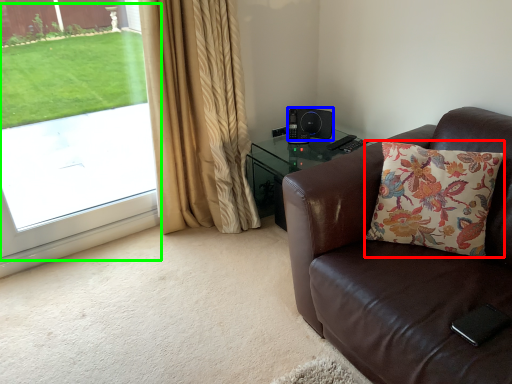
Question: Estimate the real-world distances between objects in this image. Which object is farther from pillow (highlighted by a red box), speaker (highlighted by a blue box) or window screen (highlighted by a green box)?

Choices:
 (A) speaker
 (B) window screen

Answer: (B)